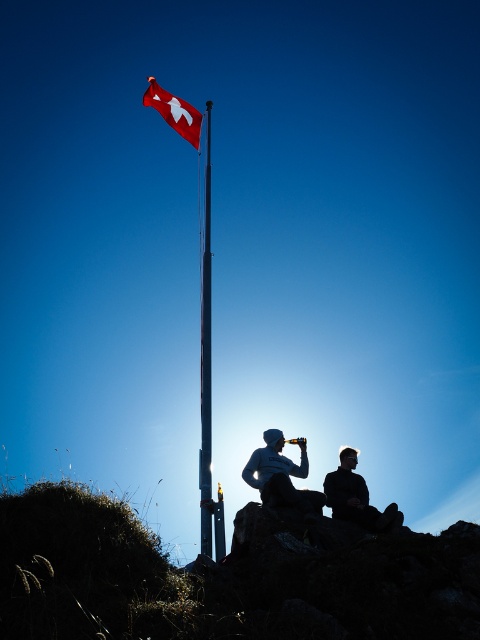
Question: Which point is closer to the camera taking this photo?

Choices:
 (A) (357, 509)
 (B) (275, 467)

Answer: (A)

Question: In this image, where is matte black beanie at center located relative to red fabric flag at upper center?

Choices:
 (A) above
 (B) below

Answer: (B)

Question: Which object is the farthest from the silhouette clothing at center?

Choices:
 (A) polished metal flag pole at center
 (B) polished metal flag pole at upper center
 (C) silhouette fabric at lower right

Answer: (A)

Question: Observing the image, what is the correct spatial positioning of silhouette clothing at center in reference to polished metal flag pole at center?

Choices:
 (A) right
 (B) left

Answer: (A)

Question: Based on their relative distances, which object is nearer to the polished metal flag pole at upper center?

Choices:
 (A) matte black beanie at center
 (B) silhouette fabric at lower right
 (C) red fabric flag at upper center

Answer: (A)

Question: Where is polished metal flag pole at center located in relation to red fabric flag at upper center in the image?

Choices:
 (A) below
 (B) above

Answer: (A)